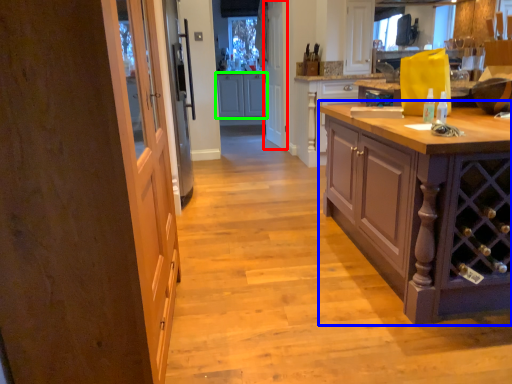
Question: Which object is positioned farthest from screen door (highlighted by a red box)? Select from cabinetry (highlighted by a blue box) and cabinetry (highlighted by a green box).

Choices:
 (A) cabinetry
 (B) cabinetry

Answer: (A)